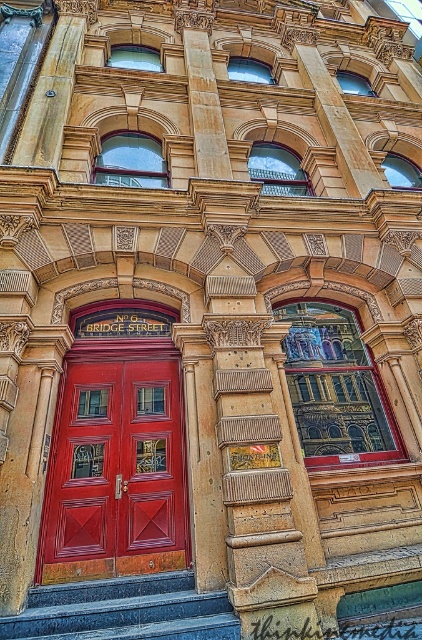
Question: Is matte wood door at center bigger than granite steps at lower center?

Choices:
 (A) yes
 (B) no

Answer: (A)

Question: Which object is closer to the camera taking this photo?

Choices:
 (A) granite steps at lower center
 (B) matte wood door at center

Answer: (A)

Question: Considering the relative positions of matte wood door at center and granite steps at lower center in the image provided, where is matte wood door at center located with respect to granite steps at lower center?

Choices:
 (A) right
 (B) left

Answer: (B)

Question: Is matte wood door at center wider than granite steps at lower center?

Choices:
 (A) no
 (B) yes

Answer: (A)

Question: Which point is farther from the camera taking this photo?

Choices:
 (A) (62, 387)
 (B) (2, 637)

Answer: (A)

Question: Which point is closer to the camera?

Choices:
 (A) matte wood door at center
 (B) granite steps at lower center

Answer: (B)